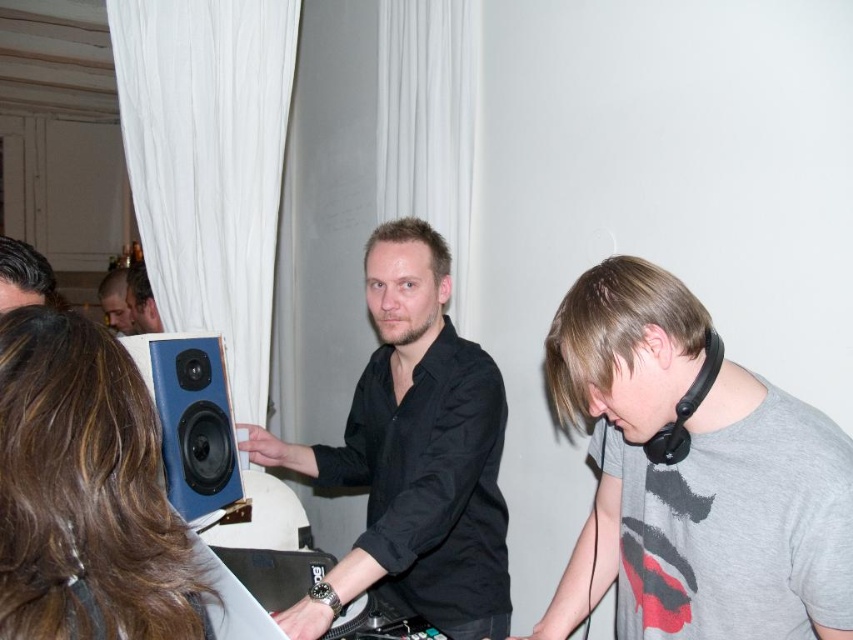
You are organizing a music event and need to ensure that the DJ equipment setup is accessible. You notice the black matte shirt at center and dark brown hair at upper left in the scene. Which object takes up more horizontal space in the image?

The black matte shirt at center takes up more horizontal space than the dark brown hair at upper left because its width surpasses the latter according to the description.